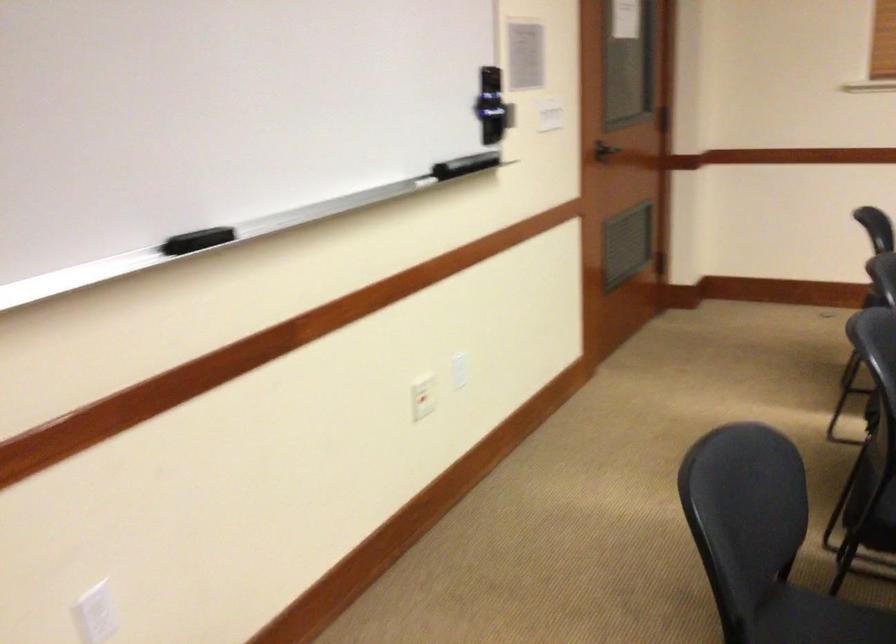
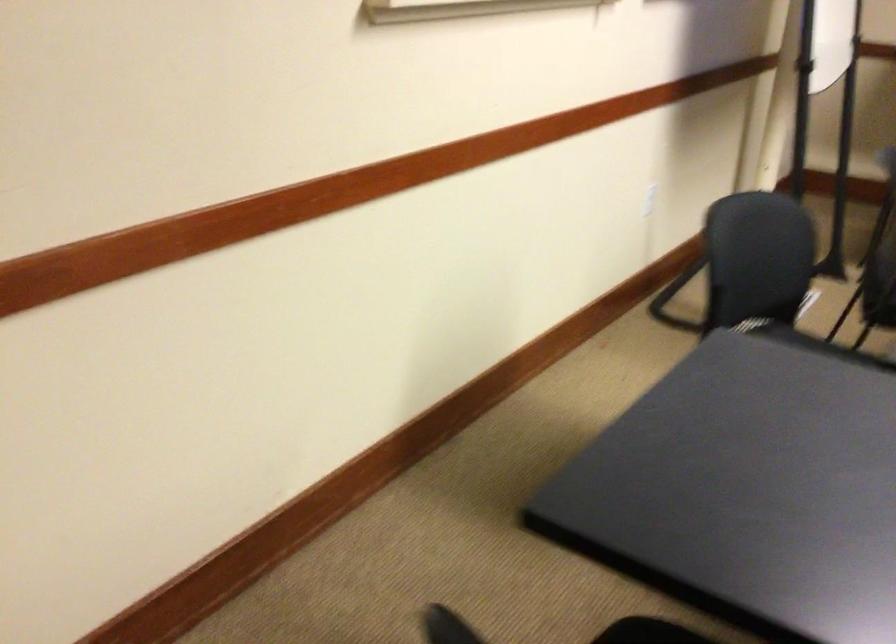
The first image is from the beginning of the video and the second image is from the end. How did the camera likely rotate when shooting the video?

The camera rotated toward right-down.